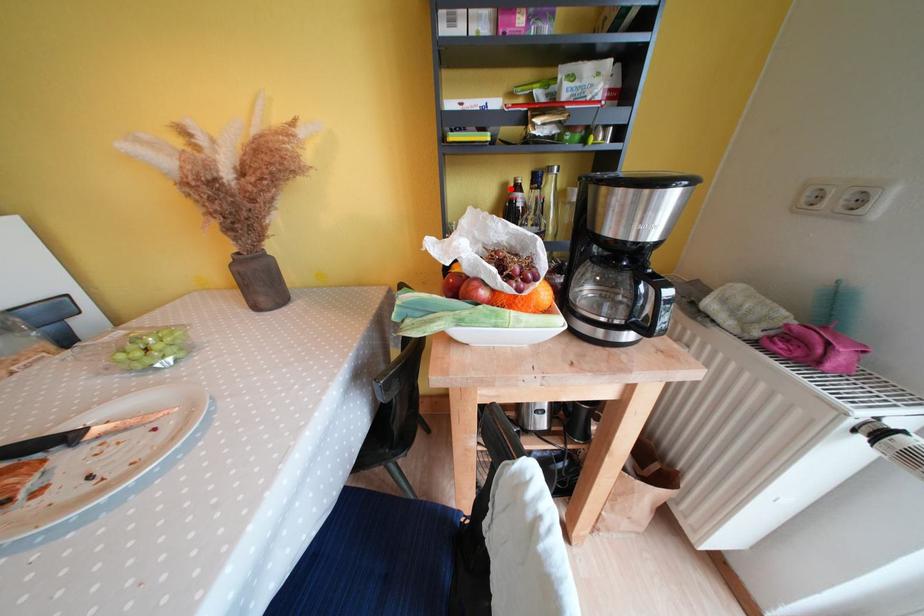
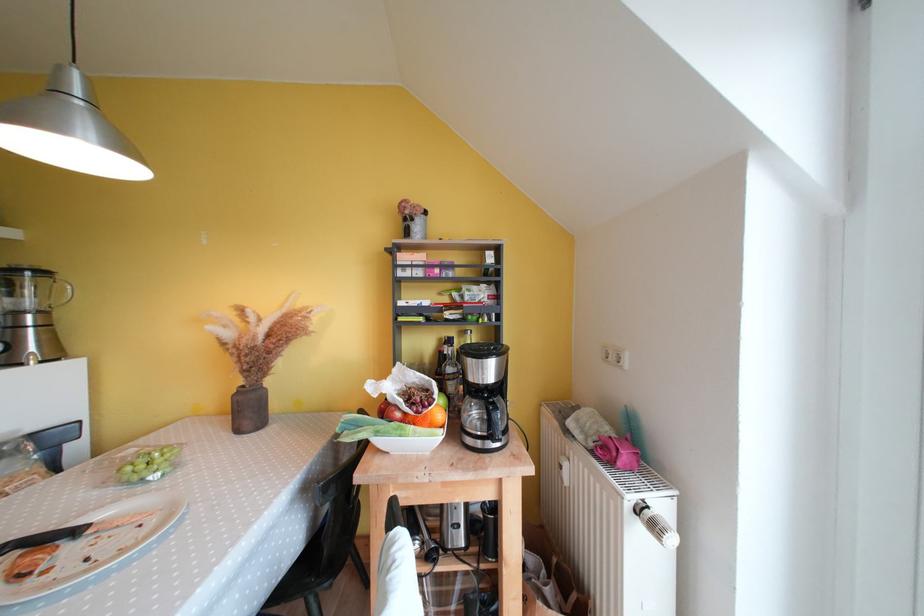
Locate, in the second image, the point that corresponds to the highlighted location in the first image.

(446, 342)